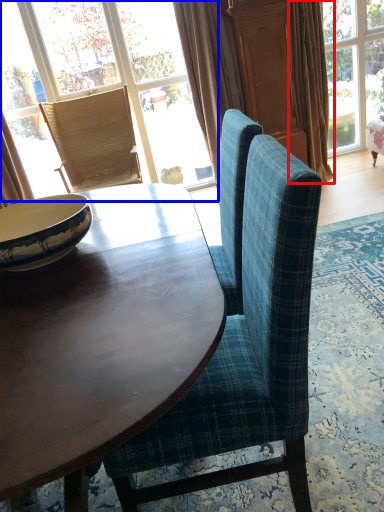
Question: Which object appears closest to the camera in this image, curtain (highlighted by a red box) or window (highlighted by a blue box)?

Choices:
 (A) curtain
 (B) window

Answer: (A)